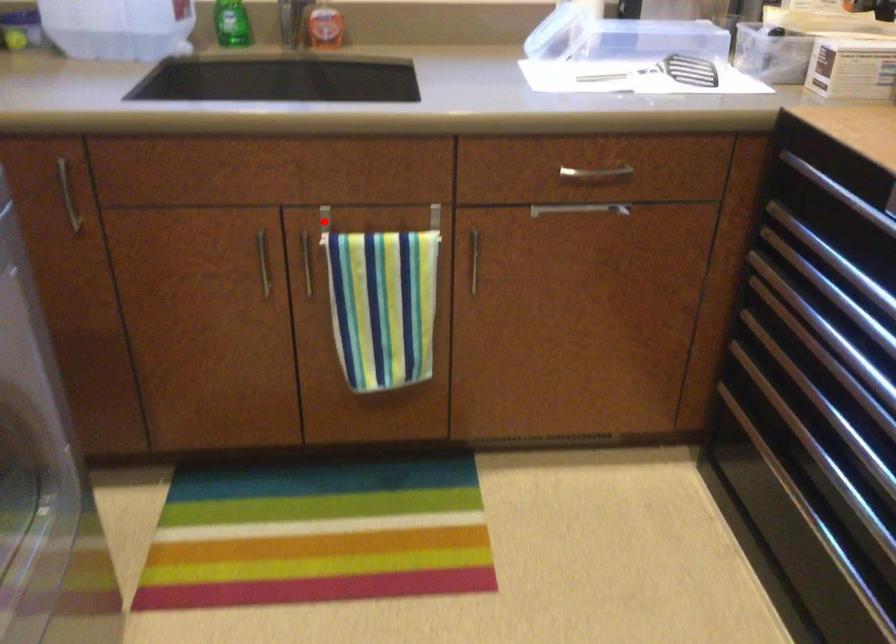
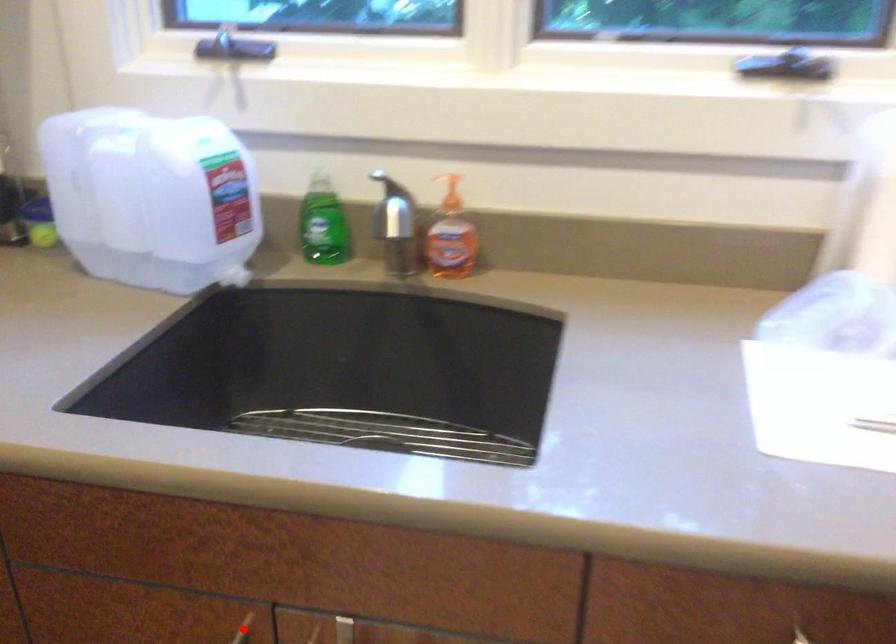
I am providing you with two images of the same scene from different viewpoints. A red point is marked on the first image and another point is marked on the second image. Are the points marked in image1 and image2 representing the same 3D position?

No